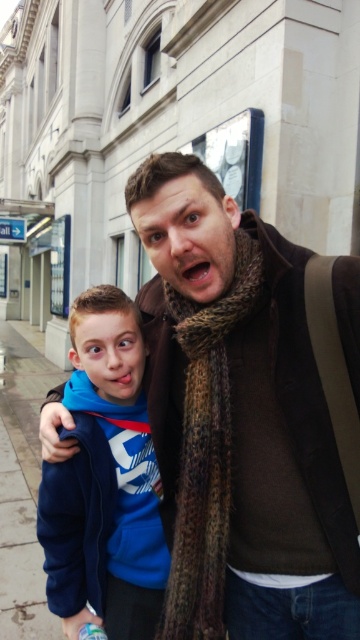
You are standing in front of the building and want to locate the blue fleece jacket at left. According to the coordinates provided, where should you look?

The blue fleece jacket at left is located at coordinates point (122, 452).

You are a photographer trying to capture a candid shot of the two people in the scene. You want to focus on the blue fleece jacket at left and the brown textured scarf at center. Based on their positions, which object should you adjust your camera angle to look up at to capture both in the frame?

You should adjust your camera angle to look up at the brown textured scarf at center because the blue fleece jacket at left is located below it, so tilting the camera upward would include both the lower jacket and the higher scarf in the frame.

You are standing at the point marked as point (190, 323) in the image. If you want to move 3 meters forward, will you exit the area shown in the image?

The point (190, 323) is 2.99 meters away from the viewer. Moving 3 meters forward from that point would take you beyond the viewer, so yes, you would exit the area shown in the image.